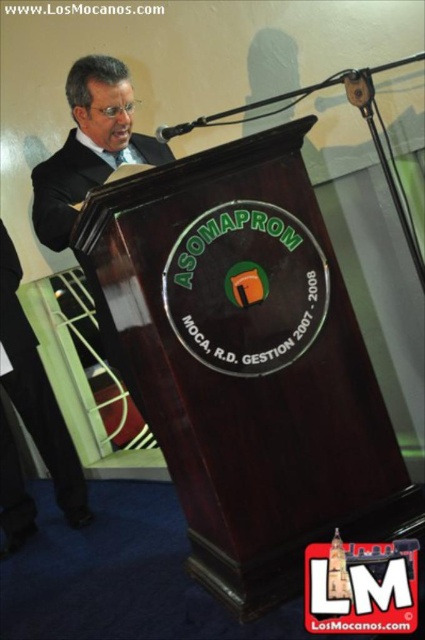
Question: Which of the following is the closest to the observer?

Choices:
 (A) black satin business suit at left
 (B) matte black suit at left

Answer: (B)

Question: Does matte black suit at left come behind black satin business suit at left?

Choices:
 (A) no
 (B) yes

Answer: (A)

Question: Can you confirm if matte black suit at left is positioned above black satin business suit at left?

Choices:
 (A) no
 (B) yes

Answer: (B)

Question: Considering the relative positions of matte black suit at left and black satin business suit at left in the image provided, where is matte black suit at left located with respect to black satin business suit at left?

Choices:
 (A) below
 (B) above

Answer: (B)